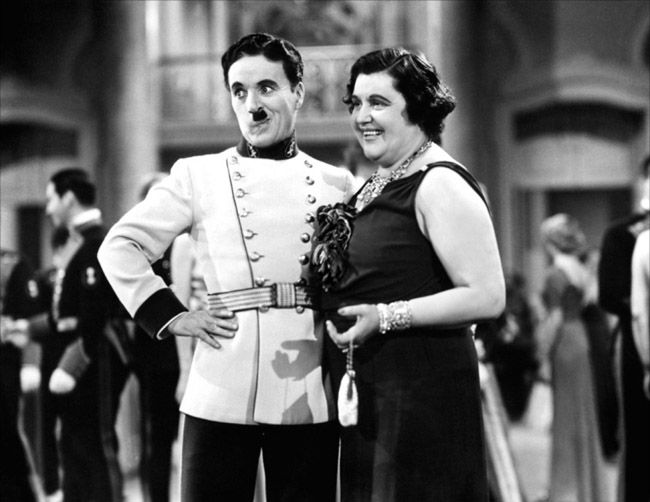
The width and height of the screenshot is (650, 502). I want to click on door, so click(593, 218).